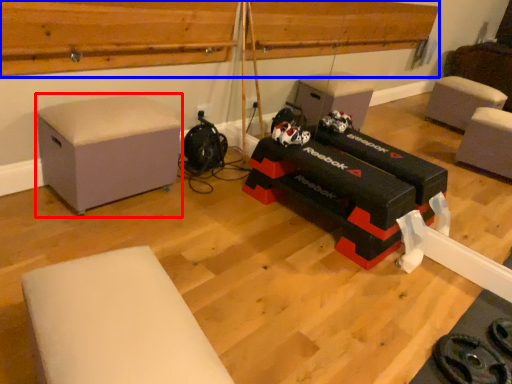
Question: Which of the following is the closest to the observer, furniture (highlighted by a red box) or wood (highlighted by a blue box)?

Choices:
 (A) furniture
 (B) wood

Answer: (B)